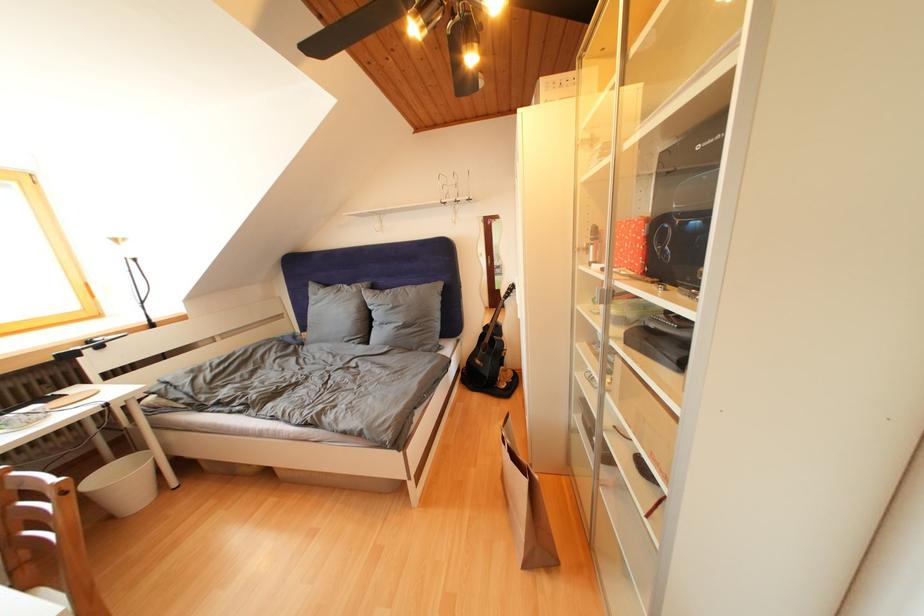
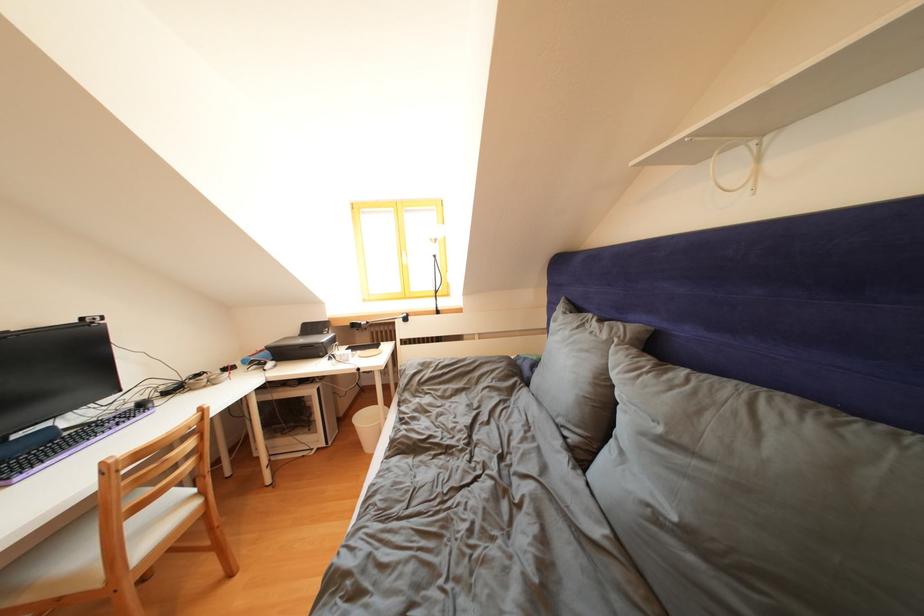
Find the pixel in the second image that matches (x=398, y=310) in the first image.

(667, 435)